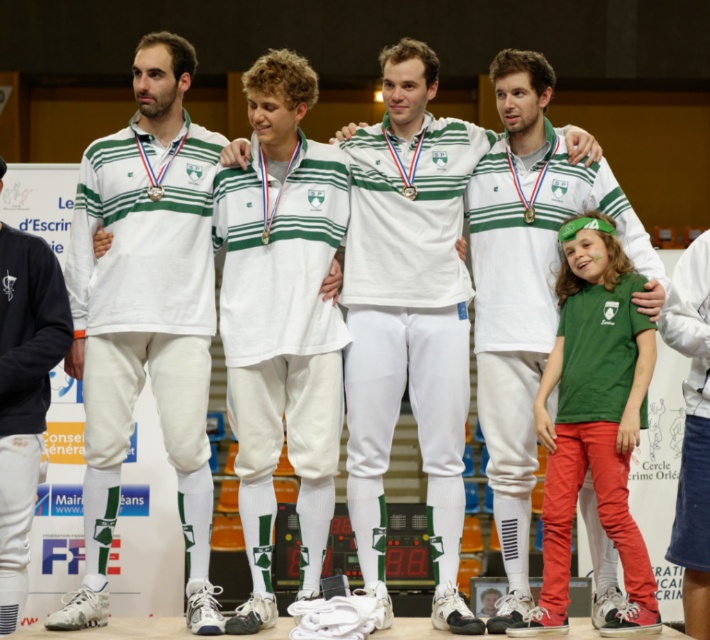
Is white smooth uniform at center taller than green jersey at right?

Correct, white smooth uniform at center is much taller as green jersey at right.

Between white smooth uniform at center and green jersey at right, which one has more height?

Standing taller between the two is white smooth uniform at center.

Image resolution: width=710 pixels, height=640 pixels. I want to click on white smooth uniform at center, so click(x=408, y=314).

Can you confirm if white smooth uniform at center is taller than white matte uniform at center?

Yes, white smooth uniform at center is taller than white matte uniform at center.

Describe the element at coordinates (408, 314) in the screenshot. This screenshot has width=710, height=640. I see `white smooth uniform at center` at that location.

Which is behind, point (469, 164) or point (240, 179)?

Positioned behind is point (469, 164).

The image size is (710, 640). Identify the location of white smooth uniform at center. (408, 314).

Measure the distance between green jersey at right and white cotton shirt at center.

The distance of green jersey at right from white cotton shirt at center is 5.56 feet.

Measure the distance between green jersey at right and camera.

A distance of 11.42 meters exists between green jersey at right and camera.

Who is more distant from viewer, [569,518] or [704,291]?

Point [704,291]

Where is `green jersey at right`? This screenshot has height=640, width=710. green jersey at right is located at coordinates (594, 419).